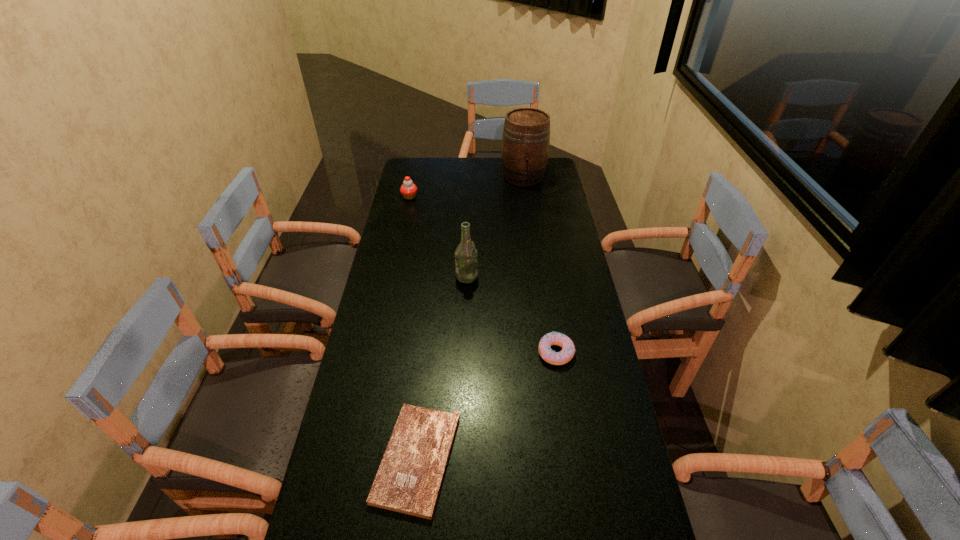
Where is `free spot that satisfies the following two spatial constraints: 1. on the side of the tallest object near the bung hole; 2. on the surface of the second tallest object`? The height and width of the screenshot is (540, 960). free spot that satisfies the following two spatial constraints: 1. on the side of the tallest object near the bung hole; 2. on the surface of the second tallest object is located at coordinates (538, 276).

I want to click on vacant space that satisfies the following two spatial constraints: 1. on the side of the tallest object near the bung hole; 2. on the surface of the third nearest object, so coord(538,276).